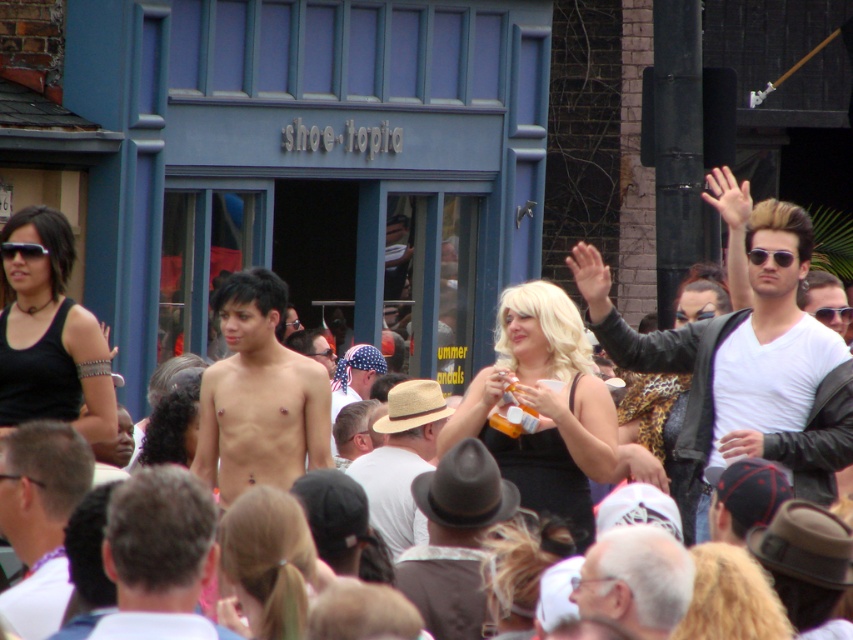
Does black matte dress at center appear on the right side of blonde hair at center?

Yes, black matte dress at center is to the right of blonde hair at center.

Based on the photo, is black matte dress at center above blonde hair at center?

Indeed, black matte dress at center is positioned over blonde hair at center.

Does point (523, 323) come closer to viewer compared to point (265, 637)?

No, (523, 323) is further to viewer.

Where is `black matte dress at center`? This screenshot has height=640, width=853. black matte dress at center is located at coordinates (543, 406).

Is point (38, 320) farther from viewer compared to point (590, 548)?

Yes, point (38, 320) is farther from viewer.

Is point (48, 227) less distant than point (616, 557)?

That is False.

Image resolution: width=853 pixels, height=640 pixels. What are the coordinates of `black matte tank top at left` in the screenshot? It's located at (49, 332).

Between black matte dress at center and naked torso at center, which one has more height?

black matte dress at center is taller.

Which is behind, point (582, 396) or point (163, 566)?

Point (582, 396)

The height and width of the screenshot is (640, 853). Find the location of `black matte dress at center`. black matte dress at center is located at coordinates (543, 406).